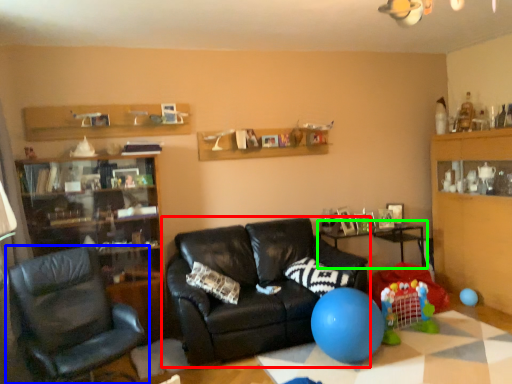
Question: Which is farther away from studio couch (highlighted by a red box)? chair (highlighted by a blue box) or table (highlighted by a green box)?

Choices:
 (A) chair
 (B) table

Answer: (B)